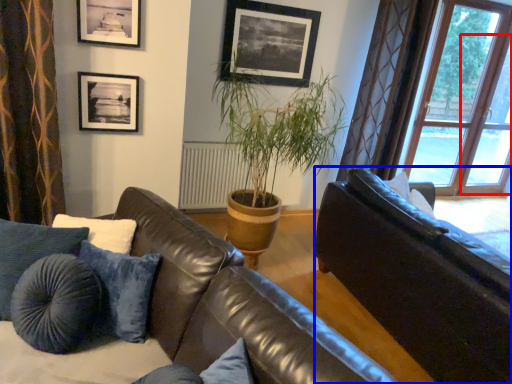
Question: Among these objects, which one is farthest to the camera, screen door (highlighted by a red box) or studio couch (highlighted by a blue box)?

Choices:
 (A) screen door
 (B) studio couch

Answer: (A)